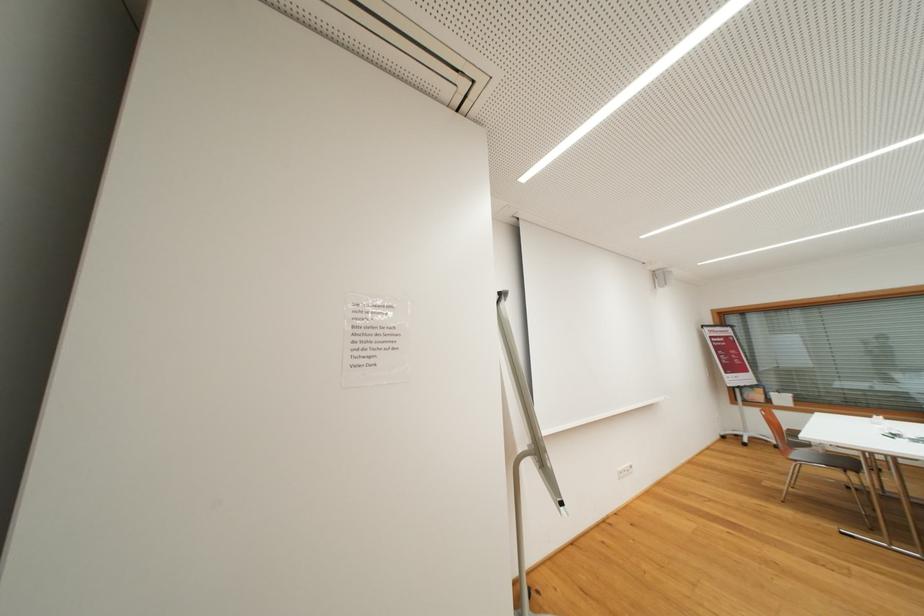
This screenshot has height=616, width=924. In order to click on flipchart handle in this screenshot , I will do `click(520, 533)`.